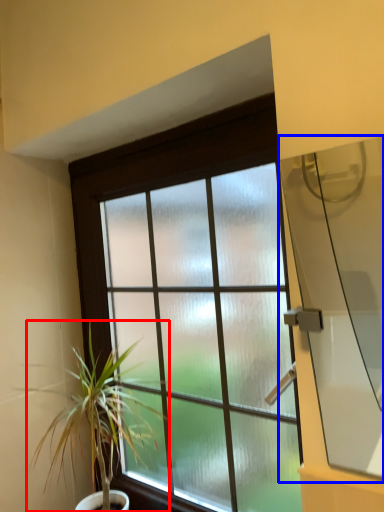
Question: Which object is closer to the camera taking this photo, houseplant (highlighted by a red box) or window screen (highlighted by a blue box)?

Choices:
 (A) houseplant
 (B) window screen

Answer: (B)